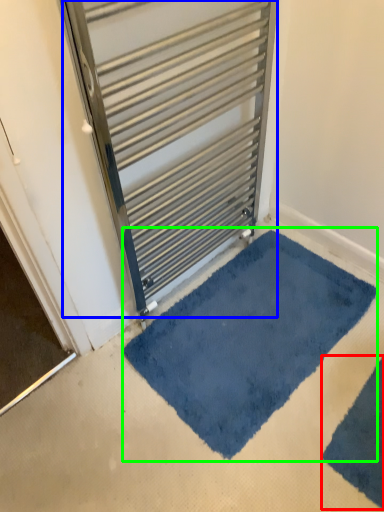
Question: Which object is positioned farthest from bath mat (highlighted by a red box)? Select from door (highlighted by a blue box) and bath mat (highlighted by a green box).

Choices:
 (A) door
 (B) bath mat

Answer: (A)